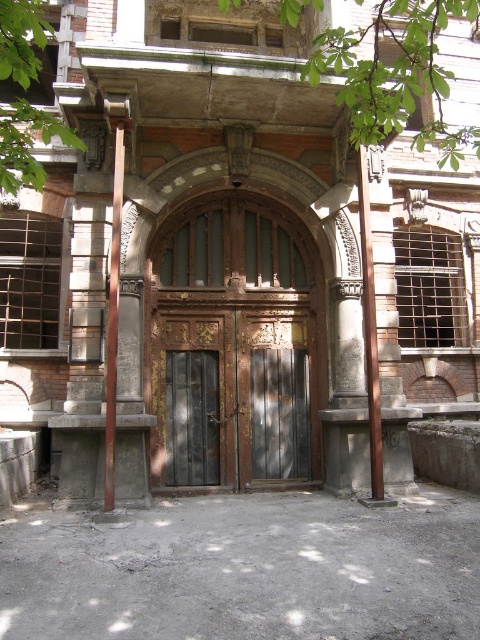
Does wooden door at center appear over brown wood post at right?

No, wooden door at center is not above brown wood post at right.

Is wooden door at center shorter than brown wood post at right?

Indeed, wooden door at center has a lesser height compared to brown wood post at right.

Who is more distant from viewer, (308, 468) or (368, 410)?

The point (308, 468) is behind.

Locate an element on the screen. The image size is (480, 640). wooden door at center is located at coordinates (232, 346).